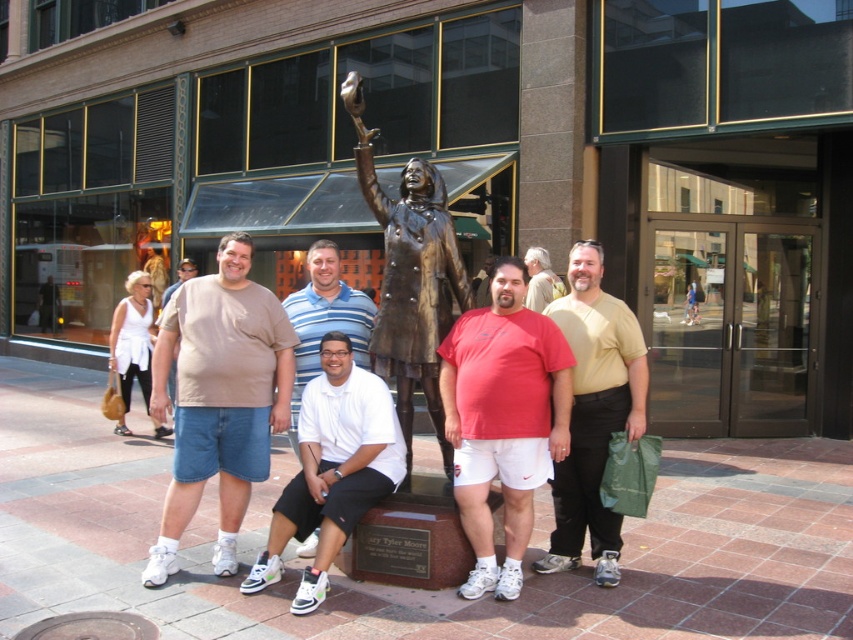
Question: Which of these objects is positioned farthest from the bronze statue at center?

Choices:
 (A) white cotton polo shirt at center
 (B) light brown shirt at center
 (C) white matte polo shirt at center
 (D) matte red t-shirt at center

Answer: (B)

Question: Which of the following is the farthest from the observer?

Choices:
 (A) white cotton polo shirt at center
 (B) white matte polo shirt at center

Answer: (A)

Question: Is matte red t-shirt at center positioned behind light brown shirt at center?

Choices:
 (A) no
 (B) yes

Answer: (A)

Question: Is white matte polo shirt at center closer to camera compared to white cotton polo shirt at center?

Choices:
 (A) no
 (B) yes

Answer: (B)

Question: Which of the following is the closest to the observer?

Choices:
 (A) (173, 321)
 (B) (529, 259)
 (C) (502, 474)

Answer: (C)

Question: Considering the relative positions of matte yellow t-shirt at center and light brown shirt at center in the image provided, where is matte yellow t-shirt at center located with respect to light brown shirt at center?

Choices:
 (A) right
 (B) left

Answer: (B)